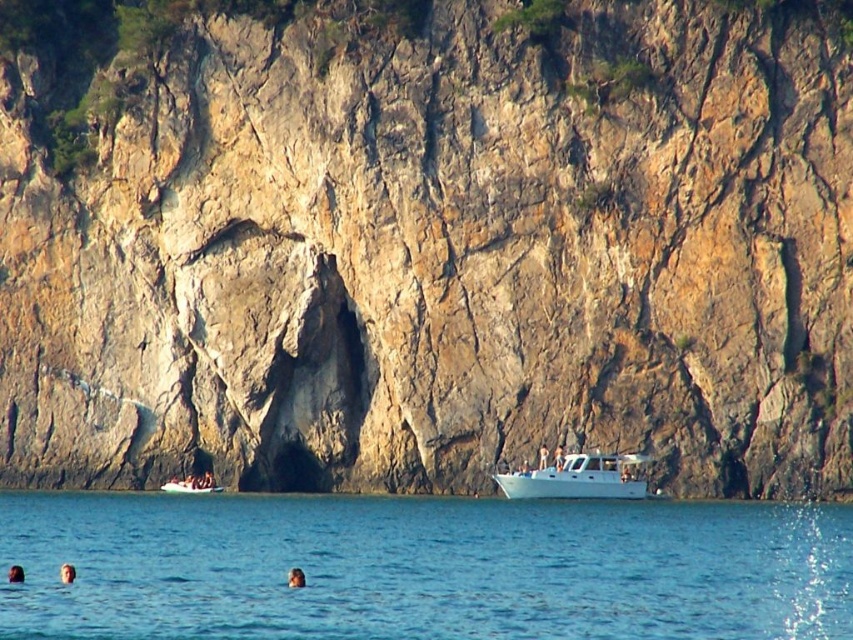
How far apart are white matte boat at lower left and smooth skin head at lower left?

white matte boat at lower left is 39.20 meters from smooth skin head at lower left.

Who is taller, white matte boat at lower left or smooth skin head at lower left?

Standing taller between the two is smooth skin head at lower left.

Image resolution: width=853 pixels, height=640 pixels. What do you see at coordinates (192, 484) in the screenshot? I see `white matte boat at lower left` at bounding box center [192, 484].

Identify the location of white matte boat at lower left. [192, 484].

Does blue water at lower center have a larger size compared to smooth skin head at lower left?

Indeed, blue water at lower center has a larger size compared to smooth skin head at lower left.

From the picture: Between blue water at lower center and smooth skin head at lower left, which one has more height?

blue water at lower center

Find the location of `blue water at lower center`. blue water at lower center is located at coordinates (422, 568).

Is smooth skin face at lower center taller than smooth skin head at lower center?

Yes, smooth skin face at lower center is taller than smooth skin head at lower center.

Does point (299, 570) lie in front of point (62, 570)?

No, (299, 570) is further to viewer.

In order to click on smooth skin face at lower center in this screenshot , I will do `click(294, 577)`.